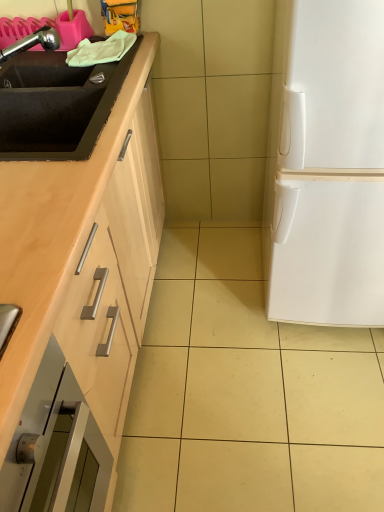
Question: In terms of width, does black matte sink at left, which appears as the second sink when viewed from the top, look wider or thinner when compared to white matte refrigerator at right?

Choices:
 (A) wide
 (B) thin

Answer: (B)

Question: From a real-world perspective, is black matte sink at left, the 1th sink when ordered from bottom to top, physically located above or below white matte refrigerator at right?

Choices:
 (A) below
 (B) above

Answer: (B)

Question: Estimate the real-world distances between objects in this image. Which object is closer to the white matte refrigerator at right?

Choices:
 (A) black matte sink at left, the 1th sink when ordered from bottom to top
 (B) chrome metallic faucet at upper left, the second sink from the bottom

Answer: (A)

Question: Estimate the real-world distances between objects in this image. Which object is farther from the black matte sink at left, the 1th sink when ordered from bottom to top?

Choices:
 (A) chrome metallic faucet at upper left, the second sink from the bottom
 (B) white matte refrigerator at right

Answer: (B)